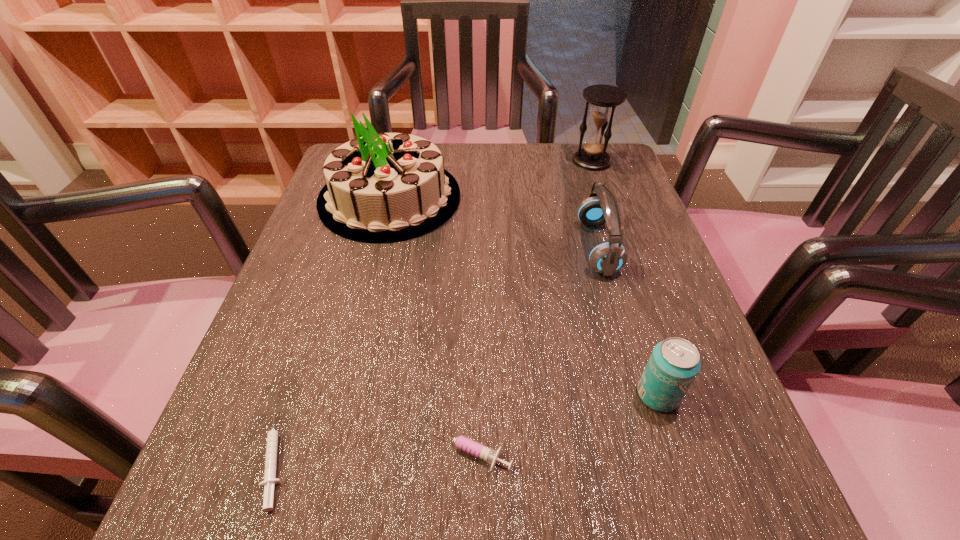
I want to click on hourglass that is at the right edge, so click(x=604, y=98).

Where is `headset at the right edge`? The height and width of the screenshot is (540, 960). headset at the right edge is located at coordinates (601, 207).

Where is `beer can at the right edge`? The image size is (960, 540). beer can at the right edge is located at coordinates (674, 363).

I want to click on object located at the far left corner, so click(382, 187).

Where is `object present at the near left corner`? Image resolution: width=960 pixels, height=540 pixels. object present at the near left corner is located at coordinates (270, 480).

Identify the location of object located in the far right corner section of the desktop. Image resolution: width=960 pixels, height=540 pixels. (604, 98).

Image resolution: width=960 pixels, height=540 pixels. I want to click on free location at the far edge, so (550, 151).

I want to click on vacant space at the near edge of the desktop, so click(x=432, y=522).

Where is `vacant space at the left edge of the desktop`? The image size is (960, 540). vacant space at the left edge of the desktop is located at coordinates (341, 245).

Locate an element on the screen. This screenshot has height=540, width=960. free space at the right edge of the desktop is located at coordinates click(663, 334).